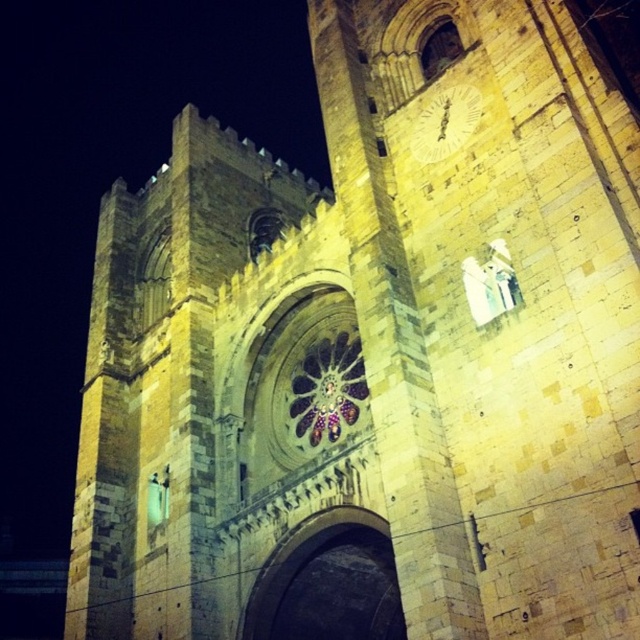
Question: Which of the following is the closest to the observer?

Choices:
 (A) (285, 589)
 (B) (465, 134)

Answer: (A)

Question: Does dark stone archway at center have a lesser width compared to white glossy clock at upper center?

Choices:
 (A) yes
 (B) no

Answer: (B)

Question: Does dark stone archway at center appear under white glossy clock at upper center?

Choices:
 (A) no
 (B) yes

Answer: (B)

Question: Which of the following is the closest to the observer?

Choices:
 (A) white glossy clock at upper center
 (B) dark stone archway at center

Answer: (B)

Question: Can you confirm if dark stone archway at center is wider than white glossy clock at upper center?

Choices:
 (A) yes
 (B) no

Answer: (A)

Question: Which object appears farthest from the camera in this image?

Choices:
 (A) dark stone archway at center
 (B) white glossy clock at upper center

Answer: (B)